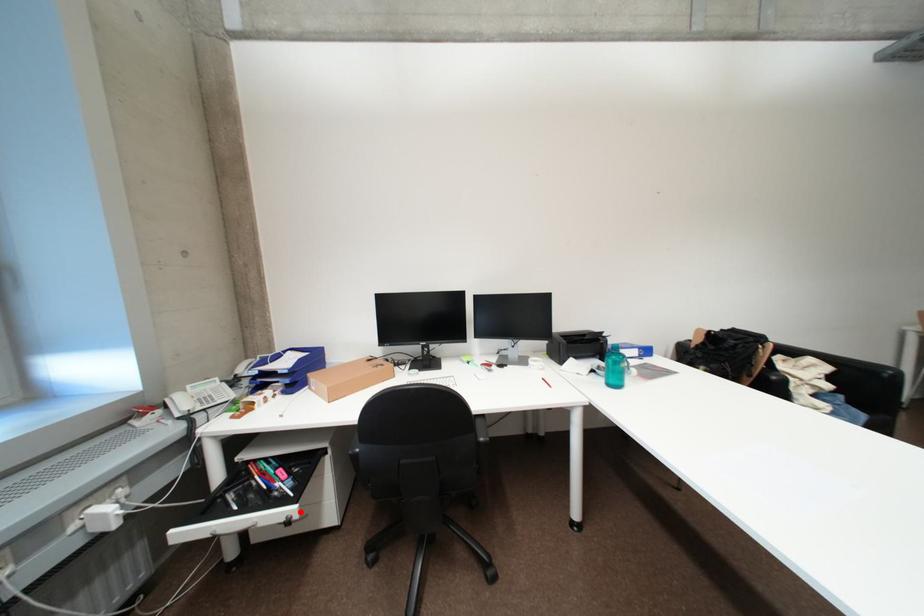
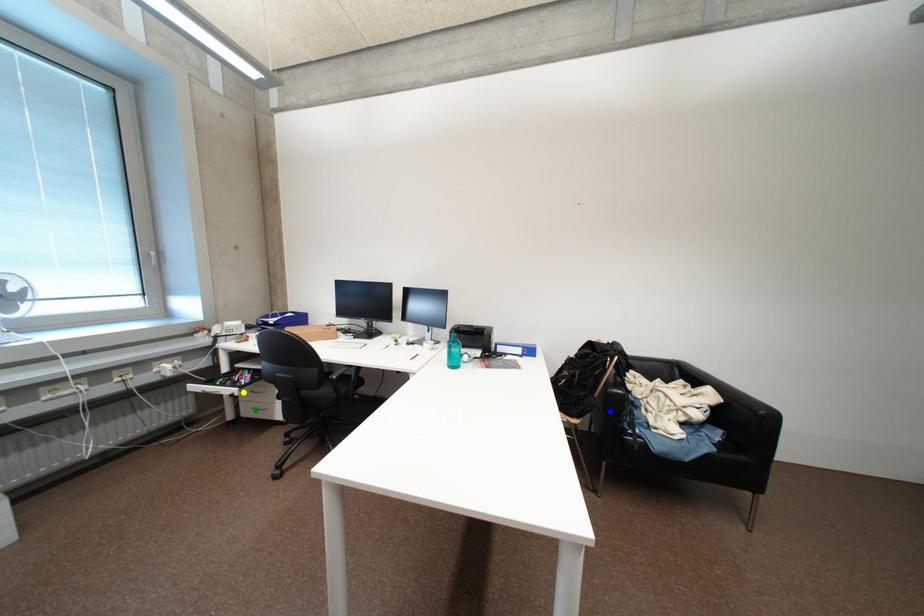
Question: I am providing you with two images of the same scene from different viewpoints. A red point is marked on the first image. You are given multiple points on the second image. Which mark in image 2 goes with the point in image 1?

Choices:
 (A) yellow point
 (B) blue point
 (C) green point

Answer: (A)